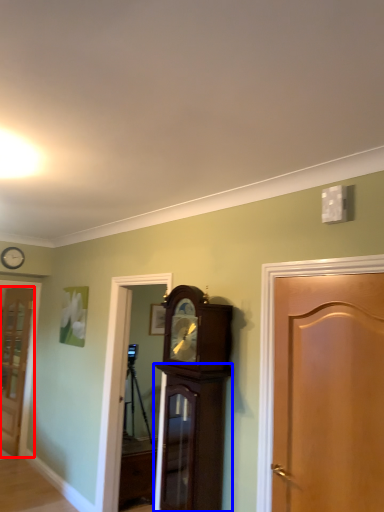
Question: Which object is further to the camera taking this photo, door (highlighted by a red box) or cabinetry (highlighted by a blue box)?

Choices:
 (A) door
 (B) cabinetry

Answer: (A)